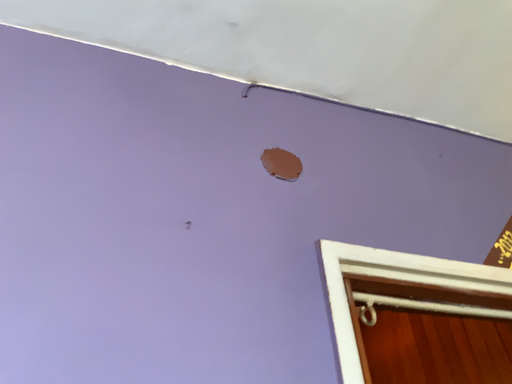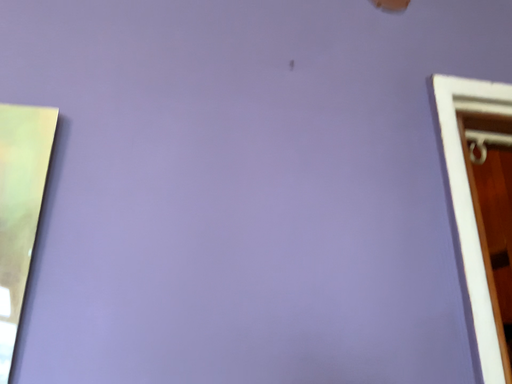
Question: Which way did the camera rotate in the video?

Choices:
 (A) rotated downward
 (B) rotated upward

Answer: (A)